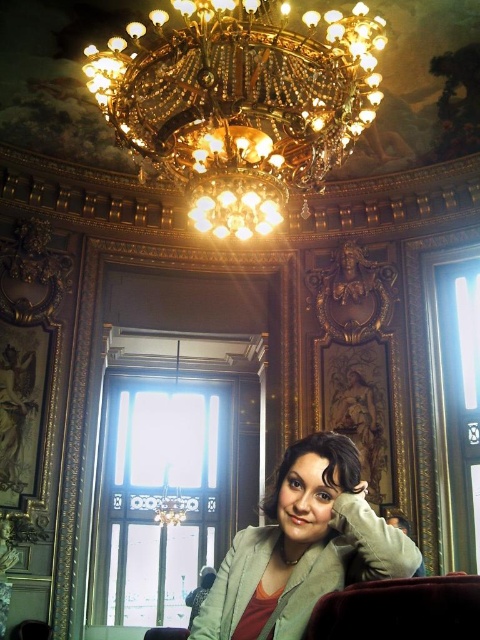
Question: Is gold crystal chandelier at upper center closer to camera compared to velvet dark brown chair at lower center?

Choices:
 (A) no
 (B) yes

Answer: (A)

Question: Which point appears closest to the camera in this image?

Choices:
 (A) (343, 570)
 (B) (251, 84)
 (C) (436, 605)

Answer: (C)

Question: Observing the image, what is the correct spatial positioning of gold crystal chandelier at upper center in reference to green matte jacket at lower right?

Choices:
 (A) below
 (B) above

Answer: (B)

Question: Is green matte jacket at lower right to the left of velvet dark brown chair at lower center from the viewer's perspective?

Choices:
 (A) no
 (B) yes

Answer: (B)

Question: Which of the following is the closest to the observer?

Choices:
 (A) green matte jacket at lower right
 (B) gold crystal chandelier at upper center
 (C) velvet dark brown chair at lower center

Answer: (C)

Question: Which point is farther to the camera?

Choices:
 (A) (315, 573)
 (B) (348, 109)

Answer: (B)